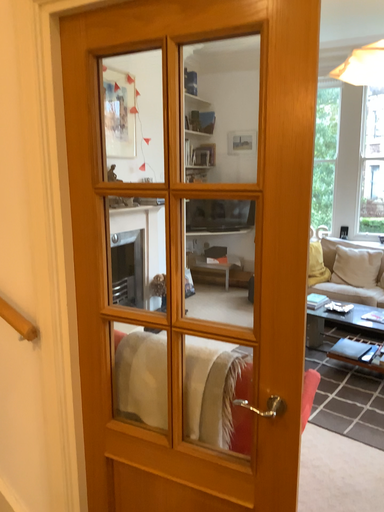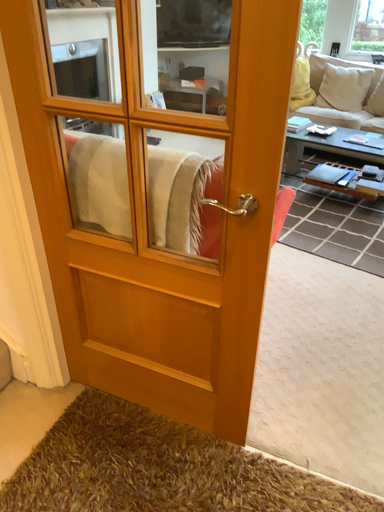
Question: Which way did the camera rotate in the video?

Choices:
 (A) rotated downward
 (B) rotated upward

Answer: (A)